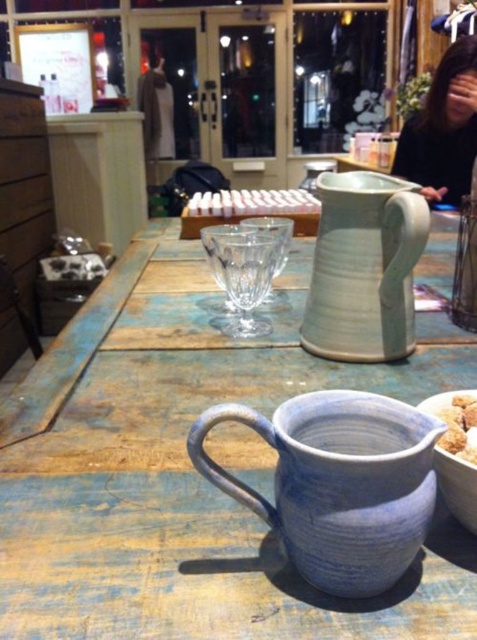
Question: Can you confirm if blue textured mug at center is positioned to the left of matte ceramic pitcher at center?

Choices:
 (A) no
 (B) yes

Answer: (B)

Question: Among these points, which one is farthest from the camera?

Choices:
 (A) (474, 49)
 (B) (446, 577)
 (C) (442, 465)

Answer: (A)

Question: Which object is farther from the camera taking this photo?

Choices:
 (A) blue textured mug at center
 (B) brown crumbly at center
 (C) matte ceramic pitcher at center

Answer: (C)

Question: Which of the following is the closest to the observer?

Choices:
 (A) (455, 470)
 (B) (351, 378)

Answer: (A)

Question: Can you confirm if blue textured pitcher at center is positioned below matte ceramic pitcher at center?

Choices:
 (A) yes
 (B) no

Answer: (A)

Question: Does dark brown hair at upper right come in front of matte white bowl at lower right?

Choices:
 (A) no
 (B) yes

Answer: (A)